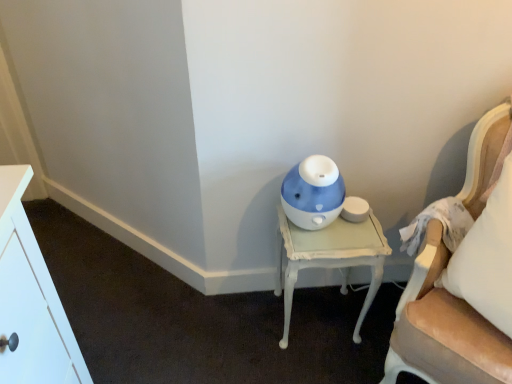
What do you see at coordinates (443, 288) in the screenshot? I see `velvet beige chair at right` at bounding box center [443, 288].

Where is `blue glossy humidifier at center`? This screenshot has height=384, width=512. blue glossy humidifier at center is located at coordinates (313, 193).

This screenshot has width=512, height=384. What do you see at coordinates (330, 258) in the screenshot? I see `white painted wood nightstand at lower right` at bounding box center [330, 258].

Find the location of a particular element. This screenshot has height=384, width=512. white painted wood nightstand at lower right is located at coordinates (330, 258).

I want to click on velvet beige chair at right, so click(x=443, y=288).

Locate an element on the screen. nightstand located below the blue glossy humidifier at center (from the image's perspective) is located at coordinates (330, 258).

Between point (281, 280) and point (298, 184), which one is positioned behind?

The point (281, 280) is farther from the camera.

How different are the orientations of white painted wood nightstand at lower right and blue glossy humidifier at center in degrees?

The angular difference between white painted wood nightstand at lower right and blue glossy humidifier at center is 1.22 degrees.

How many degrees apart are the facing directions of velvet beige chair at right and blue glossy humidifier at center?

There is a 51.3-degree angle between the facing directions of velvet beige chair at right and blue glossy humidifier at center.

Is velvet beige chair at right oriented away from blue glossy humidifier at center?

No, velvet beige chair at right's orientation is not away from blue glossy humidifier at center.

From the image's perspective, which is above, velvet beige chair at right or blue glossy humidifier at center?

blue glossy humidifier at center.

Is point (380, 383) farther from camera compared to point (290, 185)?

Yes, point (380, 383) is farther from viewer.

Is blue glossy humidifier at center positioned before white painted wood nightstand at lower right?

Yes, it is.

From a real-world perspective, is blue glossy humidifier at center positioned above or below white painted wood nightstand at lower right?

From a real-world perspective, blue glossy humidifier at center is physically above white painted wood nightstand at lower right.

Between blue glossy humidifier at center and white painted wood nightstand at lower right, which one appears on the right side from the viewer's perspective?

Positioned to the right is white painted wood nightstand at lower right.

From the image's perspective, is blue glossy humidifier at center below white painted wood nightstand at lower right?

Actually, blue glossy humidifier at center appears above white painted wood nightstand at lower right in the image.

Is point (457, 339) positioned behind point (340, 258)?

That is False.

Are velvet beige chair at right and white painted wood nightstand at lower right located far from each other?

No, velvet beige chair at right is not far away from white painted wood nightstand at lower right.

Which object is further away from the camera taking this photo, velvet beige chair at right or white painted wood nightstand at lower right?

white painted wood nightstand at lower right.

Is blue glossy humidifier at center positioned with its back to velvet beige chair at right?

No, blue glossy humidifier at center is not facing away from velvet beige chair at right.

Which object is positioned more to the right, blue glossy humidifier at center or velvet beige chair at right?

velvet beige chair at right is more to the right.

Where is `chair that is above the blue glossy humidifier at center (from a real-world perspective)`? chair that is above the blue glossy humidifier at center (from a real-world perspective) is located at coordinates [443, 288].

From the picture: Considering the sizes of blue glossy humidifier at center and velvet beige chair at right in the image, is blue glossy humidifier at center taller or shorter than velvet beige chair at right?

Clearly, blue glossy humidifier at center is shorter compared to velvet beige chair at right.

Can you confirm if white painted wood nightstand at lower right is shorter than velvet beige chair at right?

Yes.

Are white painted wood nightstand at lower right and velvet beige chair at right located far from each other?

No, white painted wood nightstand at lower right is not far from velvet beige chair at right.

From a real-world perspective, is white painted wood nightstand at lower right on top of velvet beige chair at right?

No, from a real-world perspective, white painted wood nightstand at lower right is not above velvet beige chair at right.

Find the location of a particular element. The image size is (512, 384). toy that appears above the white painted wood nightstand at lower right (from the image's perspective) is located at coordinates (313, 193).

Locate an element on the screen. The image size is (512, 384). toy behind the velvet beige chair at right is located at coordinates (313, 193).

Based on their spatial positions, is white painted wood nightstand at lower right or velvet beige chair at right further from blue glossy humidifier at center?

Among the two, velvet beige chair at right is located further to blue glossy humidifier at center.

Which object lies nearer to the anchor point blue glossy humidifier at center, velvet beige chair at right or white painted wood nightstand at lower right?

white painted wood nightstand at lower right is positioned closer to the anchor blue glossy humidifier at center.

Considering their positions, is blue glossy humidifier at center positioned closer to white painted wood nightstand at lower right than velvet beige chair at right?

blue glossy humidifier at center is closer to white painted wood nightstand at lower right.

Considering their positions, is blue glossy humidifier at center positioned further to velvet beige chair at right than white painted wood nightstand at lower right?

blue glossy humidifier at center is positioned further to the anchor velvet beige chair at right.

Considering their positions, is velvet beige chair at right positioned further to white painted wood nightstand at lower right than blue glossy humidifier at center?

velvet beige chair at right is further to white painted wood nightstand at lower right.

Which object lies further to the anchor point velvet beige chair at right, white painted wood nightstand at lower right or blue glossy humidifier at center?

Among the two, blue glossy humidifier at center is located further to velvet beige chair at right.

Where is `toy between velvet beige chair at right and white painted wood nightstand at lower right in the front-back direction`? This screenshot has height=384, width=512. toy between velvet beige chair at right and white painted wood nightstand at lower right in the front-back direction is located at coordinates pyautogui.click(x=313, y=193).